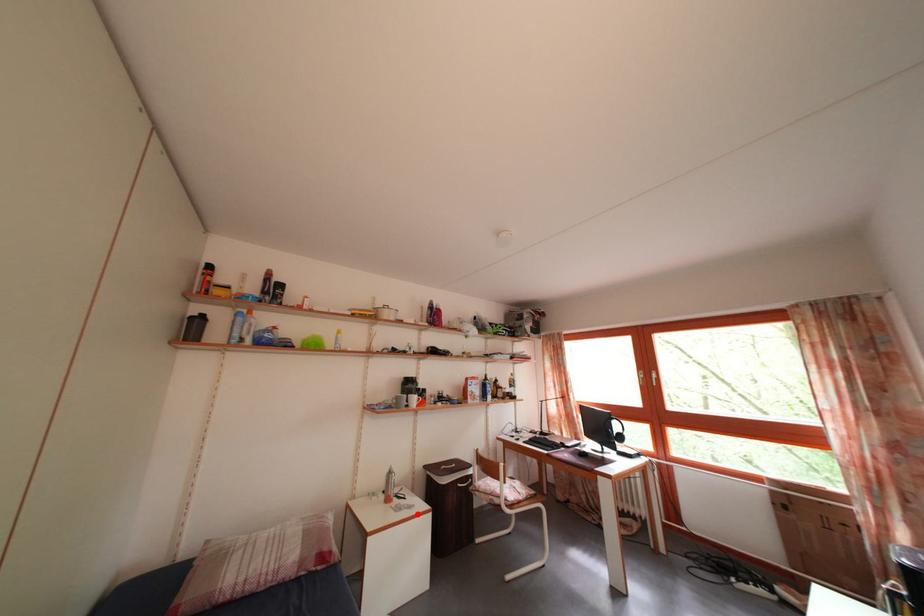
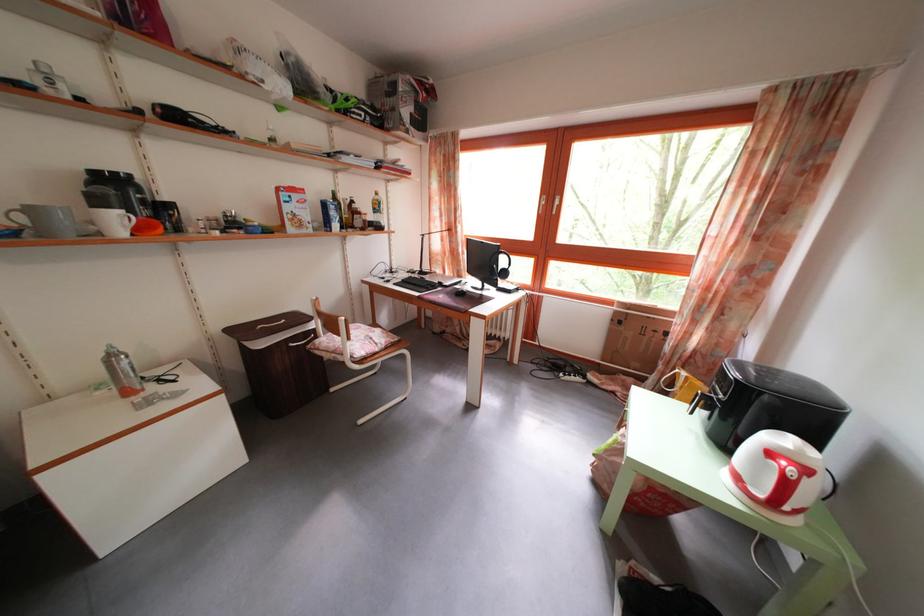
Find the pixel in the second image that matches the highlighted location in the first image.

(185, 402)